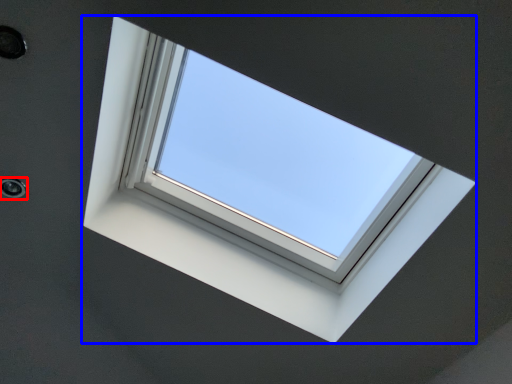
Question: Which object is further to the camera taking this photo, hole (highlighted by a red box) or window (highlighted by a blue box)?

Choices:
 (A) hole
 (B) window

Answer: (A)